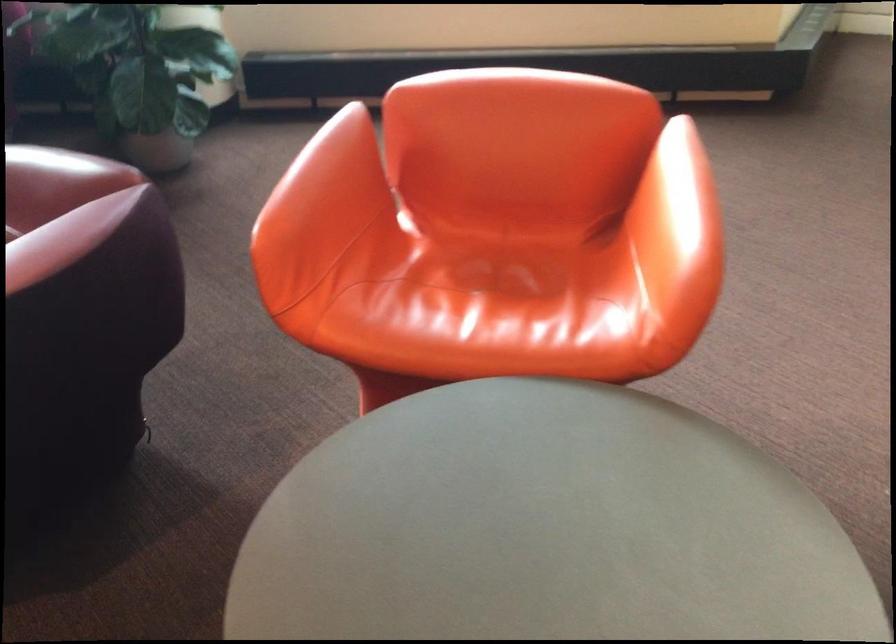
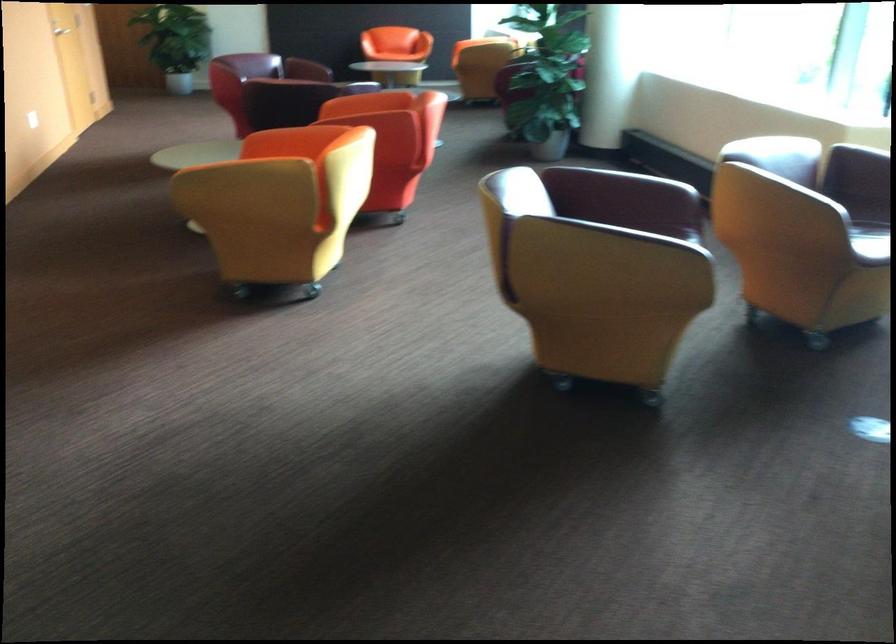
Question: I am providing you with two images of the same scene from different viewpoints. Which of the following objects are not visible in image2?

Choices:
 (A) rolled beige towel
 (B) orange chair armrest
 (C) orange chair sitting surface
 (D) red chair armrest

Answer: (B)